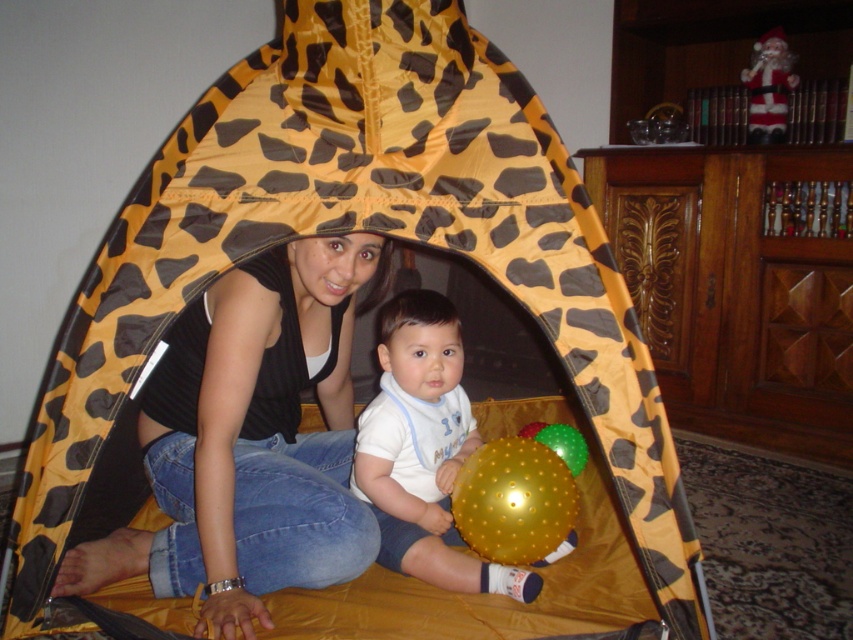
You are setting up a small Christmas display inside the leopard print tent. You have a white soft fabric at center and a santa claus figure at upper right. Which object is wider?

The white soft fabric at center is wider than the santa claus figure at upper right according to the description.

You are a photographer trying to capture a closeup of the matte black tank top at center and the santa claus figure at upper right. Since the camera can only focus on one object at a time, which object should you choose to ensure it fills the frame more?

The matte black tank top at center is bigger than the santa claus figure at upper right, so you should choose the matte black tank top at center to fill the frame more.

You are designing a layout for a childrens book. The scene requires placing a matte black tank top at center and a santa claus figure at upper right. Given their sizes, which object should you place first to ensure proper positioning?

The matte black tank top at center should be placed first since it is wider than the santa claus figure at upper right, ensuring there is enough space for it in the layout.